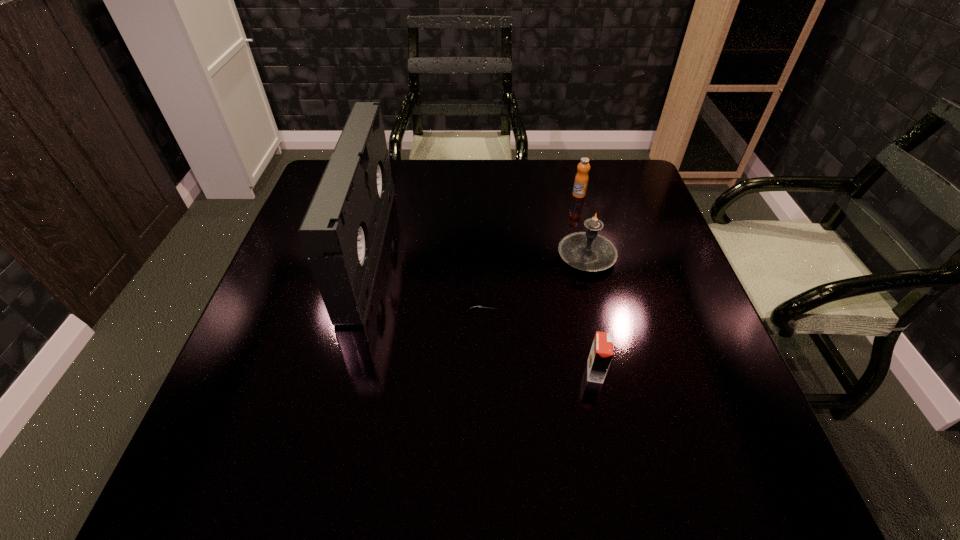
Identify the location of vacant space located 0.350m on the front of the candle. The width and height of the screenshot is (960, 540). (625, 414).

Identify the location of vacant space located on the front label of the farther orange juice. (598, 269).

At what (x,y) coordinates should I click in order to perform the action: click on vacant space located 0.130m on the back of the nearer orange juice. Please return your answer as a coordinate pair (x, y). Looking at the image, I should click on (583, 311).

Find the location of a particular element. This screenshot has height=540, width=960. vacant space located on the right of the shears is located at coordinates (555, 303).

What are the coordinates of `videotape that is at the far edge` in the screenshot? It's located at pos(342,232).

Where is `orange juice that is at the far edge`? The height and width of the screenshot is (540, 960). orange juice that is at the far edge is located at coordinates (581, 180).

Where is `object that is at the right edge`? object that is at the right edge is located at coordinates (588, 251).

Identify the location of vacant space at the far edge of the desktop. The height and width of the screenshot is (540, 960). (401, 162).

I want to click on free location at the near edge of the desktop, so click(612, 471).

Locate an element on the screen. vacant region at the left edge of the desktop is located at coordinates (307, 274).